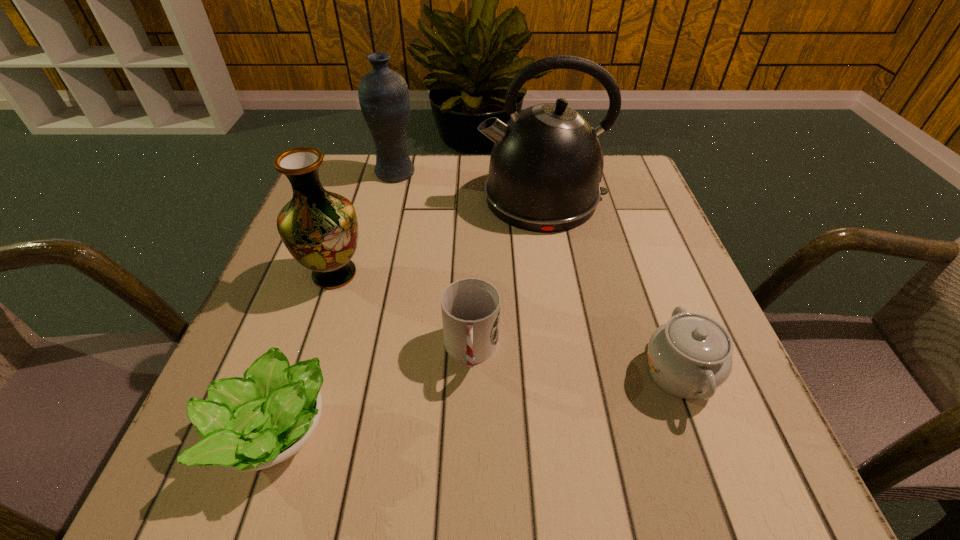
Choose which object is the fifth nearest neighbor to the farther vase. Please provide its 2D coordinates. Your answer should be formatted as a tuple, i.e. [(x, y)], where the tuple contains the x and y coordinates of a point satisfying the conditions above.

[(690, 356)]

Identify the location of vacant area in the image that satisfies the following two spatial constraints: 1. on the spout of the kettle; 2. on the back side of the chinaware. (572, 373).

Where is `free space that satisfies the following two spatial constraints: 1. on the back side of the chinaware; 2. on the left side of the lettuce`? The width and height of the screenshot is (960, 540). free space that satisfies the following two spatial constraints: 1. on the back side of the chinaware; 2. on the left side of the lettuce is located at coordinates (294, 373).